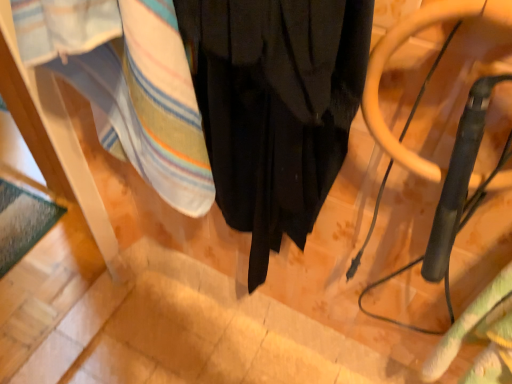
How much space does green textured blanket at lower right, arranged as the second blanket when viewed from the top, occupy horizontally?

green textured blanket at lower right, arranged as the second blanket when viewed from the top, is 4.40 inches wide.

In order to face green textured blanket at lower right, the first blanket in the right-to-left sequence, should I rotate leftwards or rightwards?

You should look right and rotate roughly 30.730 degrees.

Where is `black matte curtain at center`? The width and height of the screenshot is (512, 384). black matte curtain at center is located at coordinates (275, 107).

This screenshot has width=512, height=384. I want to click on striped cotton towel at lower left, which is the 1th blanket from left to right, so click(128, 86).

You are a GUI agent. You are given a task and a screenshot of the screen. Output one action in this format:
    pyautogui.click(x=<x>, y=<y>)
    Task: Click on the metallic gray swivel chair at right
    The image size is (512, 384).
    Given the screenshot: What is the action you would take?
    pyautogui.click(x=450, y=213)

Can you confirm if metallic gray swivel chair at right is smaller than striped cotton towel at lower left, which is the 1th blanket from left to right?

Yes, metallic gray swivel chair at right is smaller than striped cotton towel at lower left, which is the 1th blanket from left to right.

Considering the points (496, 168) and (139, 121), which point is in front, point (496, 168) or point (139, 121)?

The point (496, 168) is closer.

From the image's perspective, does metallic gray swivel chair at right appear lower than striped cotton towel at lower left, which is counted as the first blanket, starting from the top?

Yes, from the image's perspective, metallic gray swivel chair at right is below striped cotton towel at lower left, which is counted as the first blanket, starting from the top.

Considering the sizes of objects metallic gray swivel chair at right and striped cotton towel at lower left, which is counted as the first blanket, starting from the top, in the image provided, who is taller, metallic gray swivel chair at right or striped cotton towel at lower left, which is counted as the first blanket, starting from the top,?

striped cotton towel at lower left, which is counted as the first blanket, starting from the top, is taller.

Is green textured blanket at lower right, arranged as the 2th blanket when viewed from the left, facing away from black matte curtain at center?

That's not correct — green textured blanket at lower right, arranged as the 2th blanket when viewed from the left, is not looking away from black matte curtain at center.

Is point (468, 372) more distant than point (291, 112)?

Yes, it is.

In the scene shown: From the image's perspective, is green textured blanket at lower right, arranged as the 2th blanket when viewed from the left, located above or below black matte curtain at center?

From the image's perspective, green textured blanket at lower right, arranged as the 2th blanket when viewed from the left, appears below black matte curtain at center.

Is green textured blanket at lower right, acting as the first blanket starting from the bottom, taller or shorter than black matte curtain at center?

green textured blanket at lower right, acting as the first blanket starting from the bottom, is shorter than black matte curtain at center.

From a real-world perspective, is black matte curtain at center positioned over metallic gray swivel chair at right based on gravity?

Incorrect, from a real-world perspective, black matte curtain at center is lower than metallic gray swivel chair at right.

Is black matte curtain at center oriented towards metallic gray swivel chair at right?

No.

Is black matte curtain at center positioned far away from metallic gray swivel chair at right?

No.

From a real-world perspective, is black matte curtain at center located higher than green textured blanket at lower right, the first blanket in the right-to-left sequence?

Yes, from a real-world perspective, black matte curtain at center is over green textured blanket at lower right, the first blanket in the right-to-left sequence

Consider the image. Considering the sizes of black matte curtain at center and green textured blanket at lower right, arranged as the 2th blanket when viewed from the left, in the image, is black matte curtain at center bigger or smaller than green textured blanket at lower right, arranged as the 2th blanket when viewed from the left,?

In the image, black matte curtain at center appears to be larger than green textured blanket at lower right, arranged as the 2th blanket when viewed from the left.

Is black matte curtain at center spatially inside green textured blanket at lower right, arranged as the second blanket when viewed from the top, or outside of it?

black matte curtain at center exists outside the volume of green textured blanket at lower right, arranged as the second blanket when viewed from the top.

Where is `blanket below the black matte curtain at center (from the image's perspective)`? The width and height of the screenshot is (512, 384). blanket below the black matte curtain at center (from the image's perspective) is located at coordinates (480, 336).

Considering the positions of objects metallic gray swivel chair at right and black matte curtain at center in the image provided, who is more to the right, metallic gray swivel chair at right or black matte curtain at center?

Positioned to the right is metallic gray swivel chair at right.

From the image's perspective, between metallic gray swivel chair at right and black matte curtain at center, who is located below?

metallic gray swivel chair at right is shown below in the image.

Is metallic gray swivel chair at right positioned before black matte curtain at center?

Yes, metallic gray swivel chair at right is closer to the camera.

Considering the points (426, 256) and (333, 7), which point is behind, point (426, 256) or point (333, 7)?

Point (426, 256)

From the image's perspective, is striped cotton towel at lower left, which is the 1th blanket from left to right, on top of green textured blanket at lower right, acting as the first blanket starting from the bottom?

Yes, from the image's perspective, striped cotton towel at lower left, which is the 1th blanket from left to right, is on top of green textured blanket at lower right, acting as the first blanket starting from the bottom.

How different are the orientations of striped cotton towel at lower left, which is the 1th blanket from left to right, and green textured blanket at lower right, acting as the first blanket starting from the bottom, in degrees?

There is a 0.00287-degree angle between the facing directions of striped cotton towel at lower left, which is the 1th blanket from left to right, and green textured blanket at lower right, acting as the first blanket starting from the bottom.

Is striped cotton towel at lower left, which is counted as the first blanket, starting from the top, further to camera compared to green textured blanket at lower right, the first blanket in the right-to-left sequence?

No, it is in front of green textured blanket at lower right, the first blanket in the right-to-left sequence.

Looking at this image, is striped cotton towel at lower left, which is the 1th blanket from left to right, oriented towards green textured blanket at lower right, acting as the first blanket starting from the bottom?

No, striped cotton towel at lower left, which is the 1th blanket from left to right, is not turned towards green textured blanket at lower right, acting as the first blanket starting from the bottom.

Considering the relative sizes of metallic gray swivel chair at right and green textured blanket at lower right, acting as the first blanket starting from the bottom, in the image provided, is metallic gray swivel chair at right wider than green textured blanket at lower right, acting as the first blanket starting from the bottom,?

Incorrect, the width of metallic gray swivel chair at right does not surpass that of green textured blanket at lower right, acting as the first blanket starting from the bottom.

Considering the sizes of objects metallic gray swivel chair at right and green textured blanket at lower right, arranged as the second blanket when viewed from the top, in the image provided, who is taller, metallic gray swivel chair at right or green textured blanket at lower right, arranged as the second blanket when viewed from the top,?

metallic gray swivel chair at right is taller.

From the image's perspective, is metallic gray swivel chair at right positioned above or below green textured blanket at lower right, arranged as the 2th blanket when viewed from the left?

Based on their image positions, metallic gray swivel chair at right is located above green textured blanket at lower right, arranged as the 2th blanket when viewed from the left.

The width and height of the screenshot is (512, 384). There is a metallic gray swivel chair at right. Find the location of `blanket above it (from a real-world perspective)`. blanket above it (from a real-world perspective) is located at coordinates (128, 86).

The height and width of the screenshot is (384, 512). Identify the location of blanket beneath the black matte curtain at center (from a real-world perspective). pos(480,336).

In the scene shown: Which object lies further to the anchor point metallic gray swivel chair at right, striped cotton towel at lower left, the second blanket viewed from the right, or green textured blanket at lower right, acting as the first blanket starting from the bottom?

Among the two, striped cotton towel at lower left, the second blanket viewed from the right, is located further to metallic gray swivel chair at right.

Which object lies nearer to the anchor point green textured blanket at lower right, acting as the first blanket starting from the bottom, black matte curtain at center or metallic gray swivel chair at right?

Based on the image, metallic gray swivel chair at right appears to be nearer to green textured blanket at lower right, acting as the first blanket starting from the bottom.

Considering their positions, is striped cotton towel at lower left, the second blanket viewed from the right, positioned closer to black matte curtain at center than metallic gray swivel chair at right?

striped cotton towel at lower left, the second blanket viewed from the right, is closer to black matte curtain at center.

Which object lies nearer to the anchor point striped cotton towel at lower left, the second blanket viewed from the right, black matte curtain at center or metallic gray swivel chair at right?

Among the two, black matte curtain at center is located nearer to striped cotton towel at lower left, the second blanket viewed from the right.

From the image, which object appears to be nearer to striped cotton towel at lower left, which is counted as the first blanket, starting from the top, metallic gray swivel chair at right or black matte curtain at center?

black matte curtain at center is closer to striped cotton towel at lower left, which is counted as the first blanket, starting from the top.

Which object lies further to the anchor point striped cotton towel at lower left, which is counted as the 2th blanket, starting from the bottom, green textured blanket at lower right, the first blanket in the right-to-left sequence, or black matte curtain at center?

green textured blanket at lower right, the first blanket in the right-to-left sequence, lies further to striped cotton towel at lower left, which is counted as the 2th blanket, starting from the bottom, than the other object.

Looking at the image, which one is located closer to black matte curtain at center, striped cotton towel at lower left, which is counted as the 2th blanket, starting from the bottom, or green textured blanket at lower right, acting as the first blanket starting from the bottom?

Among the two, striped cotton towel at lower left, which is counted as the 2th blanket, starting from the bottom, is located nearer to black matte curtain at center.

From the image, which object appears to be farther from metallic gray swivel chair at right, green textured blanket at lower right, the first blanket in the right-to-left sequence, or black matte curtain at center?

Among the two, black matte curtain at center is located further to metallic gray swivel chair at right.

Locate an element on the screen. The image size is (512, 384). curtain between striped cotton towel at lower left, which is counted as the first blanket, starting from the top, and metallic gray swivel chair at right from left to right is located at coordinates (275, 107).

You are a GUI agent. You are given a task and a screenshot of the screen. Output one action in this format:
    pyautogui.click(x=<x>, y=<y>)
    Task: Click on the swivel chair between black matte curtain at center and green textured blanket at lower right, the first blanket in the right-to-left sequence, in the horizontal direction
    
    Given the screenshot: What is the action you would take?
    pyautogui.click(x=450, y=213)

This screenshot has width=512, height=384. I want to click on swivel chair between striped cotton towel at lower left, which is the 1th blanket from left to right, and green textured blanket at lower right, arranged as the 2th blanket when viewed from the left, in the horizontal direction, so click(x=450, y=213).

Identify the location of curtain located between striped cotton towel at lower left, which is counted as the first blanket, starting from the top, and green textured blanket at lower right, arranged as the second blanket when viewed from the top, in the left-right direction. The width and height of the screenshot is (512, 384). (275, 107).